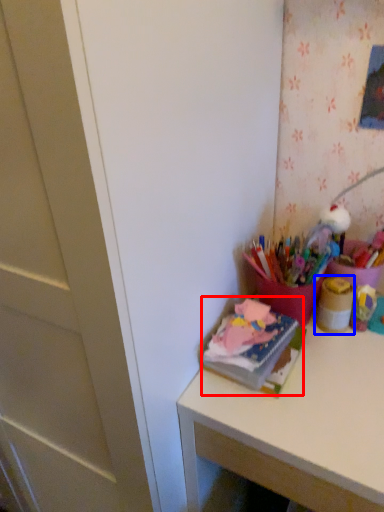
Question: Which point is closer to the camera, book (highlighted by a red box) or stationery (highlighted by a blue box)?

Choices:
 (A) book
 (B) stationery

Answer: (A)